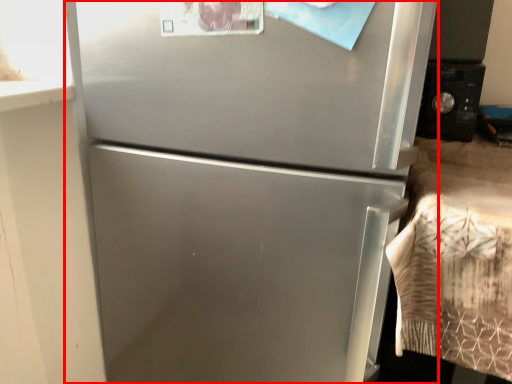
Question: In this image, where is refrigerator (annotated by the red box) located relative to appliance?

Choices:
 (A) left
 (B) right

Answer: (A)